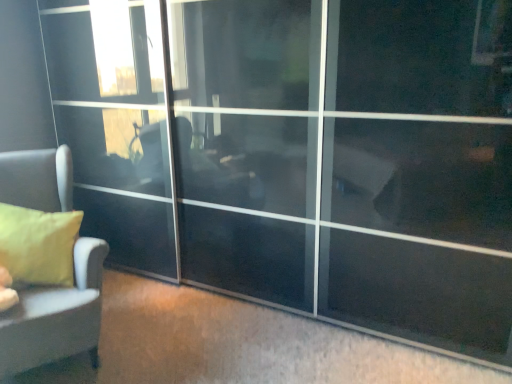
Describe the element at coordinates (38, 245) in the screenshot. I see `matte yellow pillow at left` at that location.

Image resolution: width=512 pixels, height=384 pixels. Describe the element at coordinates (56, 316) in the screenshot. I see `matte gray sofa at left` at that location.

Image resolution: width=512 pixels, height=384 pixels. What do you see at coordinates (379, 160) in the screenshot?
I see `transparent glass screen door at center` at bounding box center [379, 160].

Where is `matte yellow pillow at left`? This screenshot has height=384, width=512. matte yellow pillow at left is located at coordinates (38, 245).

Considering the points (426, 50) and (98, 255), which point is in front, point (426, 50) or point (98, 255)?

The point (426, 50) is closer.

Consider the image. Can you confirm if transparent glass screen door at center is positioned to the left of matte gray sofa at left?

No.

From the image's perspective, is transparent glass screen door at center located above matte gray sofa at left?

Yes, from the image's perspective, transparent glass screen door at center is above matte gray sofa at left.

From a real-world perspective, is transparent glass screen door at center physically above matte gray sofa at left?

Indeed, from a real-world perspective, transparent glass screen door at center stands above matte gray sofa at left.

Considering the positions of objects transparent glass screen door at center and matte yellow pillow at left in the image provided, who is in front, transparent glass screen door at center or matte yellow pillow at left?

transparent glass screen door at center.

Considering the relative sizes of transparent glass screen door at center and matte yellow pillow at left in the image provided, is transparent glass screen door at center thinner than matte yellow pillow at left?

No.

Is transparent glass screen door at center at the right side of matte yellow pillow at left?

Correct, you'll find transparent glass screen door at center to the right of matte yellow pillow at left.

Is matte yellow pillow at left in front of or behind transparent glass screen door at center in the image?

Visually, matte yellow pillow at left is located behind transparent glass screen door at center.

Considering the points (62, 257) and (413, 306), which point is behind, point (62, 257) or point (413, 306)?

The point (62, 257) is farther.

From the image's perspective, which object appears higher, matte yellow pillow at left or transparent glass screen door at center?

From the image's view, transparent glass screen door at center is above.

Which is farther from the camera, (60, 266) or (81, 290)?

The point (60, 266) is farther.

Is matte gray sofa at left at the back of matte yellow pillow at left?

Yes, matte yellow pillow at left's orientation is away from matte gray sofa at left.

Considering the sizes of objects matte yellow pillow at left and matte gray sofa at left in the image provided, who is taller, matte yellow pillow at left or matte gray sofa at left?

matte gray sofa at left.

What's the angular difference between matte gray sofa at left and transparent glass screen door at center's facing directions?

58 degrees separate the facing orientations of matte gray sofa at left and transparent glass screen door at center.

From a real-world perspective, is matte gray sofa at left located higher than transparent glass screen door at center?

Incorrect, from a real-world perspective, matte gray sofa at left is lower than transparent glass screen door at center.

Are matte gray sofa at left and transparent glass screen door at center far apart?

Yes, matte gray sofa at left and transparent glass screen door at center are located far from each other.

From a real-world perspective, does matte gray sofa at left sit lower than matte yellow pillow at left?

Indeed, from a real-world perspective, matte gray sofa at left is positioned beneath matte yellow pillow at left.

From the image's perspective, is matte gray sofa at left above matte yellow pillow at left?

No, from the image's perspective, matte gray sofa at left is not over matte yellow pillow at left.

Considering the positions of objects matte gray sofa at left and matte yellow pillow at left in the image provided, who is in front, matte gray sofa at left or matte yellow pillow at left?

matte gray sofa at left.

Are matte gray sofa at left and matte yellow pillow at left far apart?

matte gray sofa at left is actually quite close to matte yellow pillow at left.

At what (x,y) coordinates should I click in order to perform the action: click on furniture that appears below the transparent glass screen door at center (from a real-world perspective). Please return your answer as a coordinate pair (x, y). The image size is (512, 384). Looking at the image, I should click on (56, 316).

You are a GUI agent. You are given a task and a screenshot of the screen. Output one action in this format:
    pyautogui.click(x=<x>, y=<y>)
    Task: Click on the pillow behind the transparent glass screen door at center
    This screenshot has width=512, height=384.
    Given the screenshot: What is the action you would take?
    pyautogui.click(x=38, y=245)

Looking at the image, which one is located closer to matte gray sofa at left, transparent glass screen door at center or matte yellow pillow at left?

matte yellow pillow at left.

Estimate the real-world distances between objects in this image. Which object is closer to matte gray sofa at left, matte yellow pillow at left or transparent glass screen door at center?

Among the two, matte yellow pillow at left is located nearer to matte gray sofa at left.

Which object lies further to the anchor point matte yellow pillow at left, transparent glass screen door at center or matte gray sofa at left?

Based on the image, transparent glass screen door at center appears to be further to matte yellow pillow at left.

Estimate the real-world distances between objects in this image. Which object is further from transparent glass screen door at center, matte yellow pillow at left or matte gray sofa at left?

matte gray sofa at left is further to transparent glass screen door at center.

From the image, which object appears to be farther from matte yellow pillow at left, matte gray sofa at left or transparent glass screen door at center?

transparent glass screen door at center lies further to matte yellow pillow at left than the other object.

Considering their positions, is matte gray sofa at left positioned further to transparent glass screen door at center than matte yellow pillow at left?

matte gray sofa at left is positioned further to the anchor transparent glass screen door at center.

This screenshot has width=512, height=384. Identify the location of furniture situated between matte yellow pillow at left and transparent glass screen door at center from left to right. (56, 316).